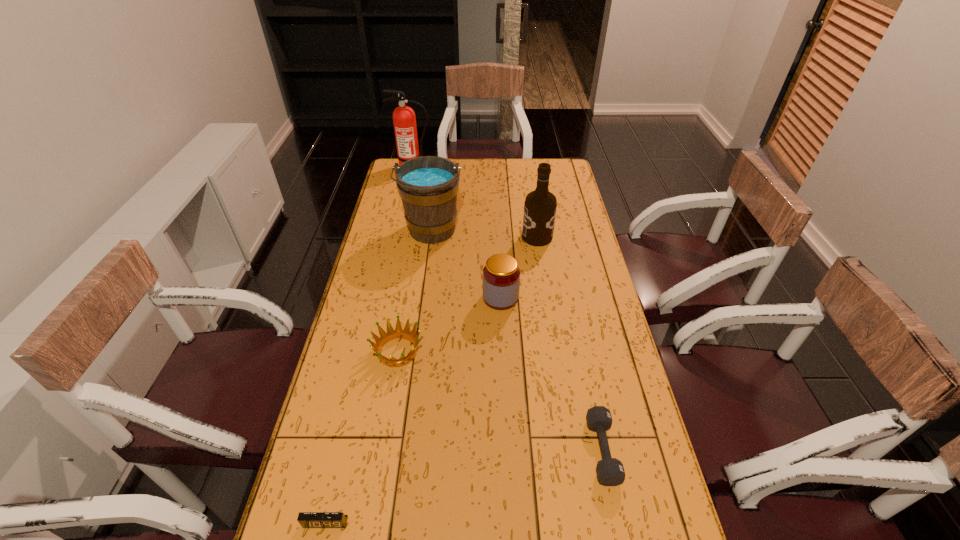
Find the location of a particular element. This screenshot has width=960, height=540. free space between the fourth tallest object and the nearest object is located at coordinates (413, 410).

Identify which object is located as the sixth nearest to the fire extinguisher. Please provide its 2D coordinates. Your answer should be formatted as a tuple, i.e. [(x, y)], where the tuple contains the x and y coordinates of a point satisfying the conditions above.

[(306, 519)]

At what (x,y) coordinates should I click in order to perform the action: click on object that ranks as the fifth closest to the alcohol. Please return your answer as a coordinate pair (x, y). Looking at the image, I should click on (610, 471).

Identify the location of free space that satisfies the following two spatial constraints: 1. on the label of the alcohol; 2. on the front-facing side of the nearest object. (581, 522).

Locate an element on the screen. blank area in the image that satisfies the following two spatial constraints: 1. on the back side of the second shortest object; 2. on the label of the alcohol is located at coordinates (558, 237).

You are a GUI agent. You are given a task and a screenshot of the screen. Output one action in this format:
    pyautogui.click(x=<x>, y=<y>)
    Task: Click on the free space in the image that satisfies the following two spatial constraints: 1. with a handle on the side of the wine bucket; 2. on the left side of the second shortest object
    The height and width of the screenshot is (540, 960).
    Given the screenshot: What is the action you would take?
    coord(403,450)

This screenshot has width=960, height=540. I want to click on vacant space that satisfies the following two spatial constraints: 1. on the label of the alcohol; 2. on the front side of the third nearest object, so click(555, 351).

This screenshot has height=540, width=960. I want to click on vacant area that satisfies the following two spatial constraints: 1. on the back side of the sixth farthest object; 2. on the label of the alcohol, so (558, 237).